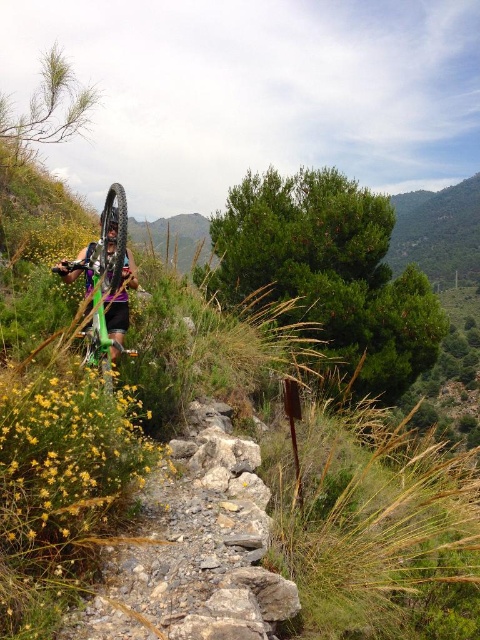
Consider the image. You are a hiker planning to navigate the rocky gravel trail at center. Given that the trail is at coordinates point 0.859, 0.412, can you estimate its location relative to the image frame?

The rocky gravel trail at center is located at coordinates point (x=197, y=548), which places it near the lower central part of the image frame.

You are a hiker who wants to ride your green matte bicycle at center down the rocky gravel trail at center. Can you safely ride your bicycle down the trail?

The rocky gravel trail at center is located below the green matte bicycle at center, which means the trail slopes downward. This slope could make it easier to ride down, but the rocky and gravelly surface may pose challenges like instability or traction issues. Proceed with caution, ensuring the trail is safe for cycling.

You are a hiker with a 1.7 meter long backpack. You want to walk along the rocky gravel trail at center. Can your backpack fit through the space between the trail and the camera?

The distance between the rocky gravel trail at center and the camera is 2.82 meters. Since your backpack is 1.7 meters long, it will fit comfortably within the space.